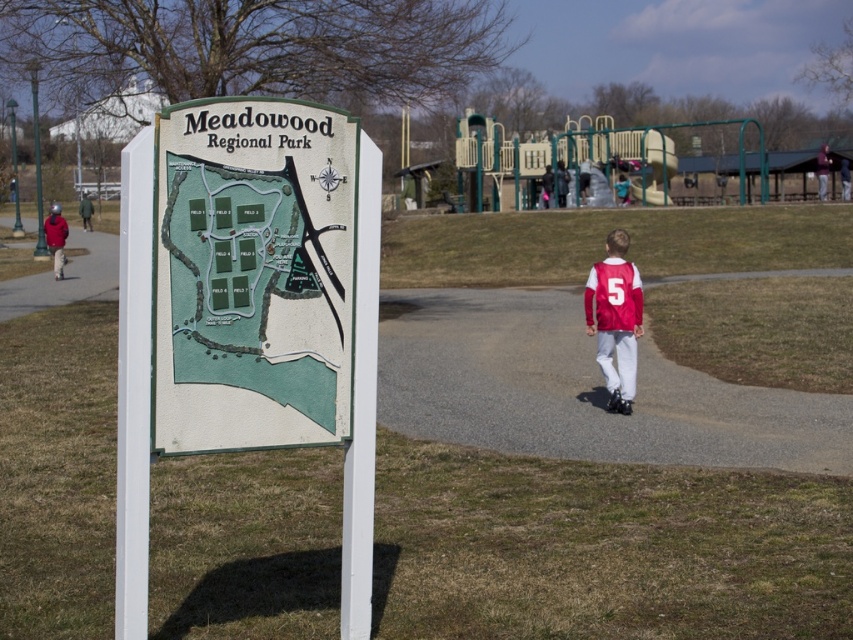
You are at Meadowood Regional Park and see the gray asphalt path at center and the matte red jersey at center. Which object is closer to you according to the park sign?

The gray asphalt path at center is positioned over the matte red jersey at center, so the gray asphalt path at center is closer to you.

You are at Meadowood Regional Park and want to locate the playground. The park map on the sign shows a green matte map at center with a point marked at coordinates (250,285). Where is this point located relative to the playground on the map?

The point at coordinates (250,285) is on the green matte map at center, so it is located at the center of the map where the playground is depicted.

You are standing at the Meadowood Regional Park sign and want to reach the playground. According to the park map, where should you look to find the gray asphalt path at center that leads towards the playground?

The gray asphalt path at center is located at point (579, 388) on the map, so you should look towards the center area of the map to find it leading towards the playground.